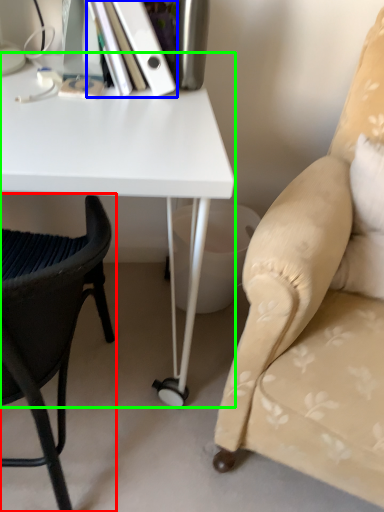
Question: Based on their relative distances, which object is nearer to chair (highlighted by a red box)? Choose from paperback book (highlighted by a blue box) and desk (highlighted by a green box).

Choices:
 (A) paperback book
 (B) desk

Answer: (B)